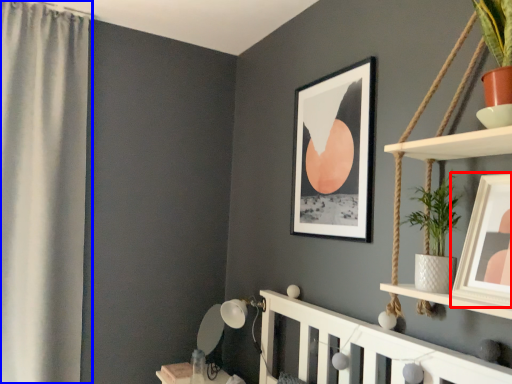
Question: Among these objects, which one is nearest to the camera, picture frame (highlighted by a red box) or curtain (highlighted by a blue box)?

Choices:
 (A) picture frame
 (B) curtain

Answer: (A)